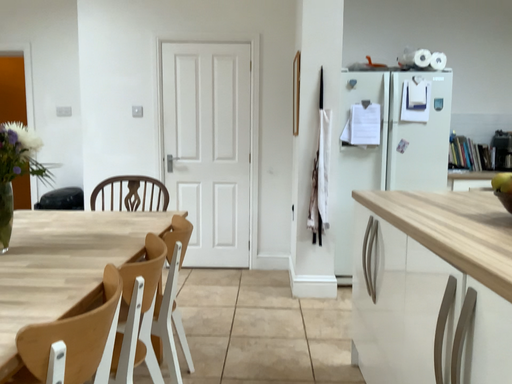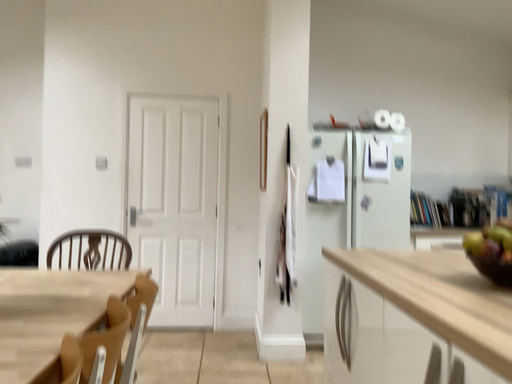
Question: How did the camera likely rotate when shooting the video?

Choices:
 (A) rotated upward
 (B) rotated downward

Answer: (A)